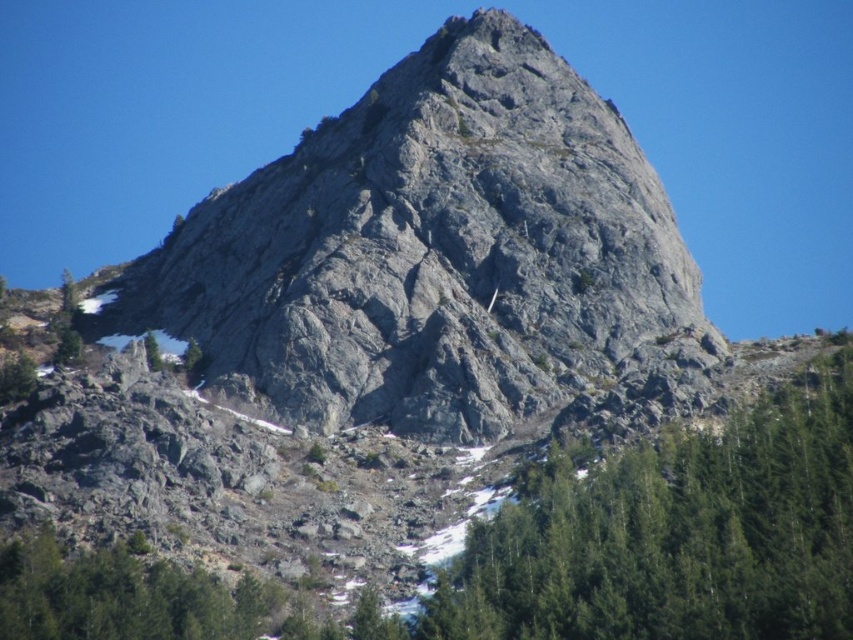
How far apart are gray rocky mountain at center and green textured tree at center?

gray rocky mountain at center is 25.34 meters from green textured tree at center.

Which is more to the right, gray rocky mountain at center or green textured tree at center?

Positioned to the right is green textured tree at center.

You are a GUI agent. You are given a task and a screenshot of the screen. Output one action in this format:
    pyautogui.click(x=<x>, y=<y>)
    Task: Click on the gray rocky mountain at center
    
    Given the screenshot: What is the action you would take?
    pyautogui.click(x=442, y=259)

What do you see at coordinates (674, 532) in the screenshot?
I see `green textured tree at center` at bounding box center [674, 532].

Who is more forward, (x=585, y=600) or (x=161, y=365)?

Point (x=585, y=600) is more forward.

Measure the distance between green textured tree at center and camera.

green textured tree at center and camera are 64.62 meters apart.

Find the location of a particular element. The width and height of the screenshot is (853, 640). green textured tree at center is located at coordinates (674, 532).

Is gray rocky mountain at center thinner than green matte tree at lower left?

No, gray rocky mountain at center is not thinner than green matte tree at lower left.

Is gray rocky mountain at center positioned at the back of green matte tree at lower left?

No, it is in front of green matte tree at lower left.

Who is more distant from viewer, (115, 323) or (148, 346)?

Positioned behind is point (115, 323).

Where is `gray rocky mountain at center`? The height and width of the screenshot is (640, 853). gray rocky mountain at center is located at coordinates (442, 259).